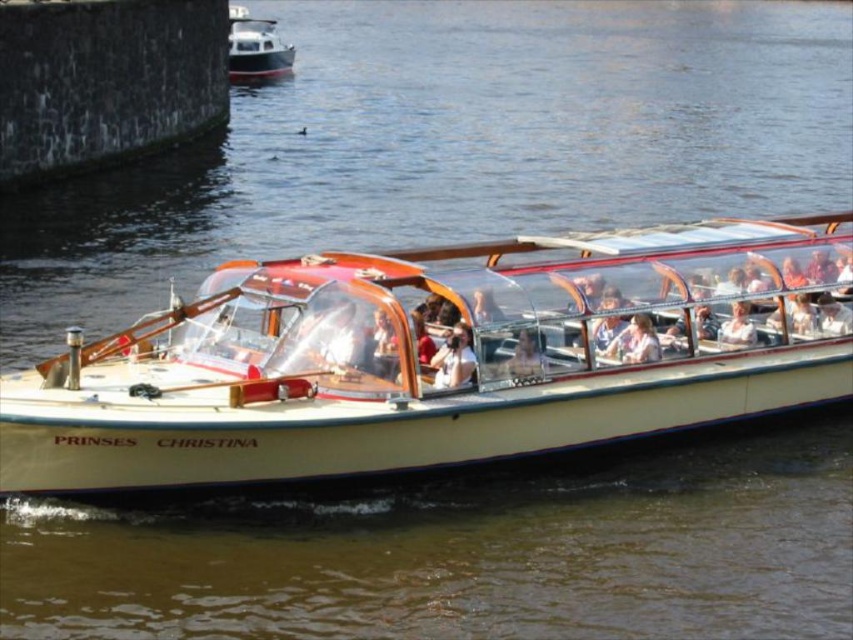
You are standing on the deck of the boat and see both the light brown leather jacket at center and the light beige fabric jacket at center. Which jacket is nearer to you?

The light brown leather jacket at center is closer to the viewer than the light beige fabric jacket at center.

You are a photographer standing on the deck of the boat Prinses Christina. You want to take a photo of both the light brown leather jacket at center and the matte white shirt at center in the same frame. The camera you have can capture objects up to 4 meters apart in the same shot. Will both subjects fit in your photo?

The light brown leather jacket at center and the matte white shirt at center are 3.79 meters apart from each other. Since the camera can capture objects up to 4 meters apart, both subjects will fit in the photo.